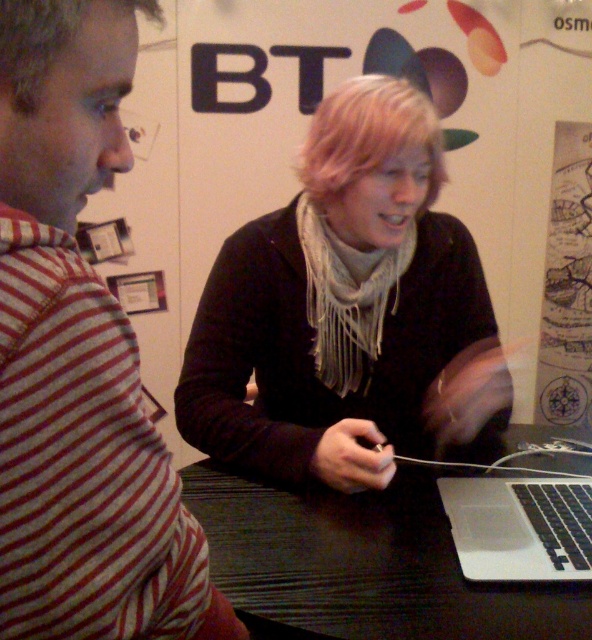
You are a photographer at a BT event. You need to take a photo of the two people at the table so that both their faces are clearly visible. The black matte scarf at center and the blondehair at left are currently positioned in a way that might block each other. Based on their current positions, which person should move forward to ensure both faces are visible in the photo?

The blondehair at left is behind the black matte scarf at center. To ensure both faces are visible, the person with blondehair at left should move forward so they are no longer blocked by the black matte scarf at center.

You are standing 5 feet away from the backdrop with the BT logo. You want to reach the point at coordinates point (382, 429). Can you reach it without moving closer than 3.92 feet?

The distance of point (382, 429) from viewer is 3.92 feet. Since you are already 5 feet away, you are further away than the required distance. To reach the point, you need to move closer to 3.92 feet.

You are a photographer standing 30 inches away from the two people with blonde hair. You want to take a photo of both of them in the same frame. Given that your camera has a maximum focus range of 25 inches, will you be able to capture both blondehair at center and blondehair at left clearly in the photo?

The blondehair at center is 23.73 inches away from blondehair at left. Since the photographer is standing 30 inches away from both, the distance between them is within the camera maximum focus range of 25 inches. Therefore, both blondehair at center and blondehair at left can be captured clearly in the photo.